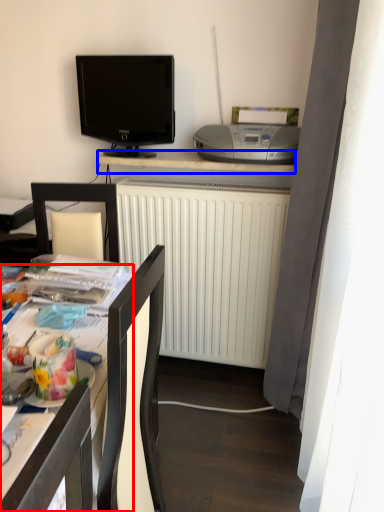
Question: Among these objects, which one is nearest to the camera, desk (highlighted by a red box) or desk (highlighted by a blue box)?

Choices:
 (A) desk
 (B) desk

Answer: (A)